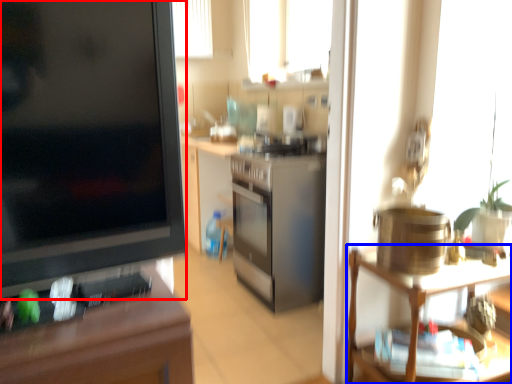
Question: Which of the following is the farthest to the observer, desk (highlighted by a red box) or shelf (highlighted by a blue box)?

Choices:
 (A) desk
 (B) shelf

Answer: (B)